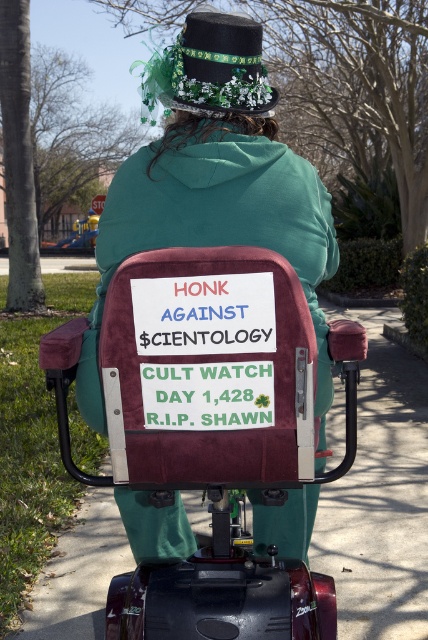
You are a pedestrian walking on the sidewalk and you see the velvety maroon scooter at center and the green felt hat at upper center. Which object is more to the left?

The velvety maroon scooter at center is positioned on the left side of green felt hat at upper center, so the velvety maroon scooter at center is more to the left.

You are a pedestrian walking on the sidewalk in the image. You notice two points marked on the ground. One is at point [124,236] and the other at point [226,26]. Which point would you reach first while walking forward?

Point [124,236] is in front of point [226,26], so you would reach point [124,236] first while walking forward.

In the scene shown: You are a delivery robot that needs to pass through a narrow alleyway that is only 1.2 meters wide. You see the velvety maroon scooter at center and the green felt hat at upper center in your path. Which object must you avoid hitting to ensure you can fit through the alleyway?

The velvety maroon scooter at center has a larger width than the green felt hat at upper center, so you must avoid hitting the velvety maroon scooter at center to ensure you can fit through the alleyway.